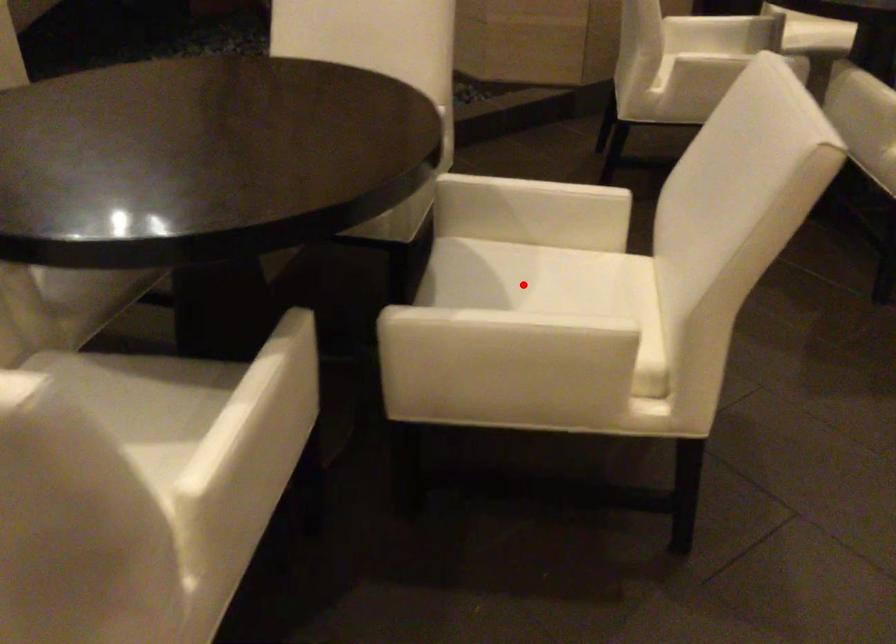
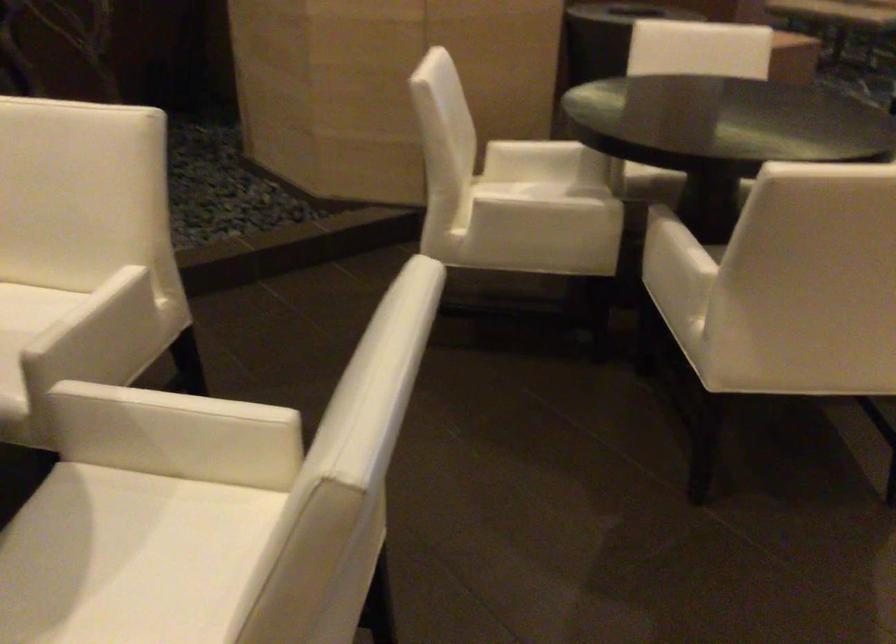
Find the pixel in the second image that matches the highlighted location in the first image.

(122, 558)